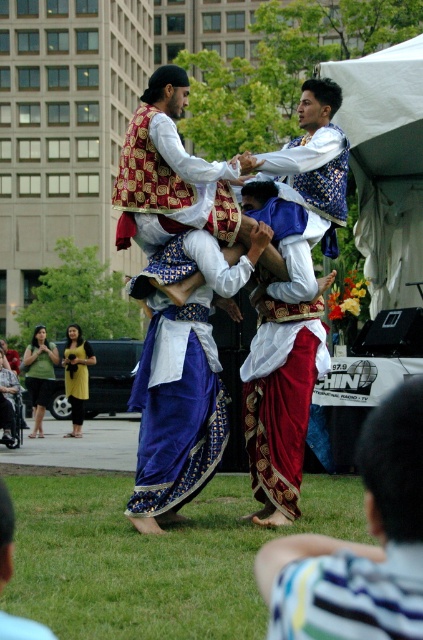
Is striped fabric pants at lower right smaller than yellow fabric dress at lower left?

Actually, striped fabric pants at lower right might be larger than yellow fabric dress at lower left.

Measure the distance between striped fabric pants at lower right and camera.

striped fabric pants at lower right is 2.37 meters away from camera.

Identify the location of striped fabric pants at lower right. The width and height of the screenshot is (423, 640). (349, 595).

Is blue velvet vest at center to the right of green fabric dress at lower left from the viewer's perspective?

Yes, blue velvet vest at center is to the right of green fabric dress at lower left.

Image resolution: width=423 pixels, height=640 pixels. Describe the element at coordinates (315, 154) in the screenshot. I see `blue velvet vest at center` at that location.

Does point (285, 173) come behind point (36, 417)?

No.

At what (x,y) coordinates should I click in order to perform the action: click on blue velvet vest at center. Please return your answer as a coordinate pair (x, y). The width and height of the screenshot is (423, 640). Looking at the image, I should click on (315, 154).

The height and width of the screenshot is (640, 423). Describe the element at coordinates (153, 557) in the screenshot. I see `green grass at lower center` at that location.

Is point (145, 570) less distant than point (324, 182)?

Yes, point (145, 570) is closer to viewer.

Measure the distance between green grass at lower center and camera.

green grass at lower center and camera are 9.26 meters apart from each other.

The height and width of the screenshot is (640, 423). I want to click on green grass at lower center, so click(153, 557).